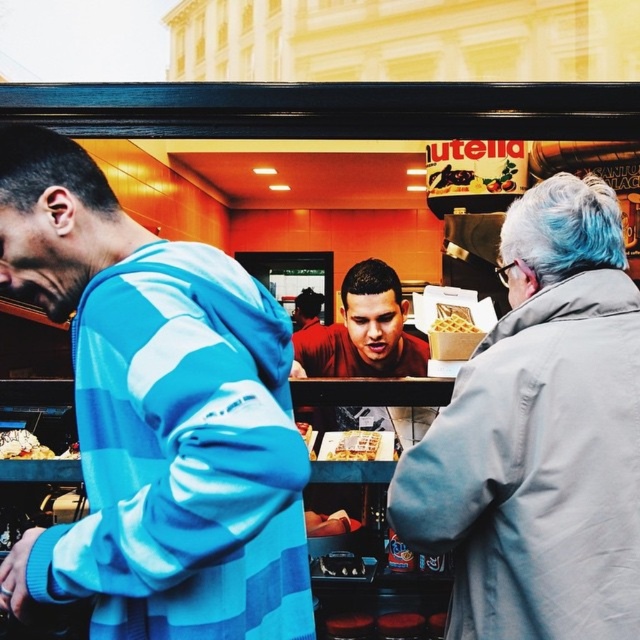
Can you confirm if blue striped hoodie at left is thinner than smooth chocolate spread at center?

In fact, blue striped hoodie at left might be wider than smooth chocolate spread at center.

Does blue striped hoodie at left come in front of smooth chocolate spread at center?

That is True.

Does point (54, 317) come behind point (513, 164)?

No, it is not.

You are a GUI agent. You are given a task and a screenshot of the screen. Output one action in this format:
    pyautogui.click(x=<x>, y=<y>)
    Task: Click on the blue striped hoodie at left
    
    Given the screenshot: What is the action you would take?
    pyautogui.click(x=157, y=417)

Is light gray coat at center shorter than smooth chocolate spread at center?

Incorrect, light gray coat at center's height does not fall short of smooth chocolate spread at center's.

Is light gray coat at center below smooth chocolate spread at center?

Yes.

Where is `light gray coat at center`? The width and height of the screenshot is (640, 640). light gray coat at center is located at coordinates (540, 436).

Identify the location of light gray coat at center. (540, 436).

Does smooth chocolate spread at center appear over red matte shirt at center?

Correct, smooth chocolate spread at center is located above red matte shirt at center.

Looking at this image, does smooth chocolate spread at center have a lesser width compared to red matte shirt at center?

In fact, smooth chocolate spread at center might be wider than red matte shirt at center.

I want to click on smooth chocolate spread at center, so click(472, 179).